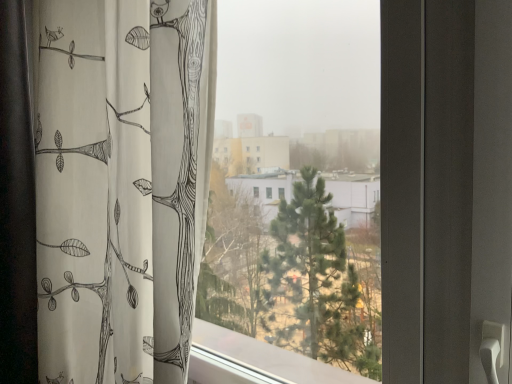
Question: Is transparent glass window at center in front of or behind white fabric curtain at left in the image?

Choices:
 (A) behind
 (B) front

Answer: (B)

Question: In terms of size, does transparent glass window at center appear bigger or smaller than white fabric curtain at left?

Choices:
 (A) small
 (B) big

Answer: (A)

Question: Is point (236, 99) closer or farther from the camera than point (176, 120)?

Choices:
 (A) closer
 (B) farther

Answer: (B)

Question: Is white fabric curtain at left wider or thinner than transparent glass window at center?

Choices:
 (A) thin
 (B) wide

Answer: (B)

Question: Relative to transparent glass window at center, is white fabric curtain at left in front or behind?

Choices:
 (A) front
 (B) behind

Answer: (B)

Question: From a real-world perspective, is white fabric curtain at left above or below transparent glass window at center?

Choices:
 (A) above
 (B) below

Answer: (A)

Question: Is white fabric curtain at left situated inside transparent glass window at center or outside?

Choices:
 (A) outside
 (B) inside

Answer: (A)